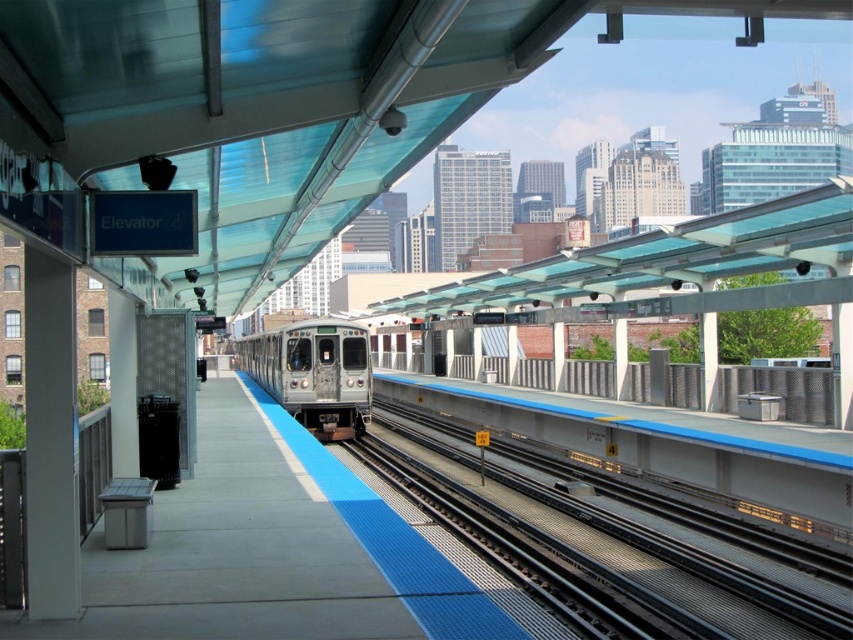
In the scene shown: Measure the distance from metallic gray tracks at center to silver metallic train at center.

metallic gray tracks at center is 12.04 meters away from silver metallic train at center.

Identify the location of metallic gray tracks at center. (689, 560).

Is point (430, 440) closer to camera compared to point (329, 355)?

No, it is not.

Find the location of a particular element. The width and height of the screenshot is (853, 640). metallic gray tracks at center is located at coordinates (689, 560).